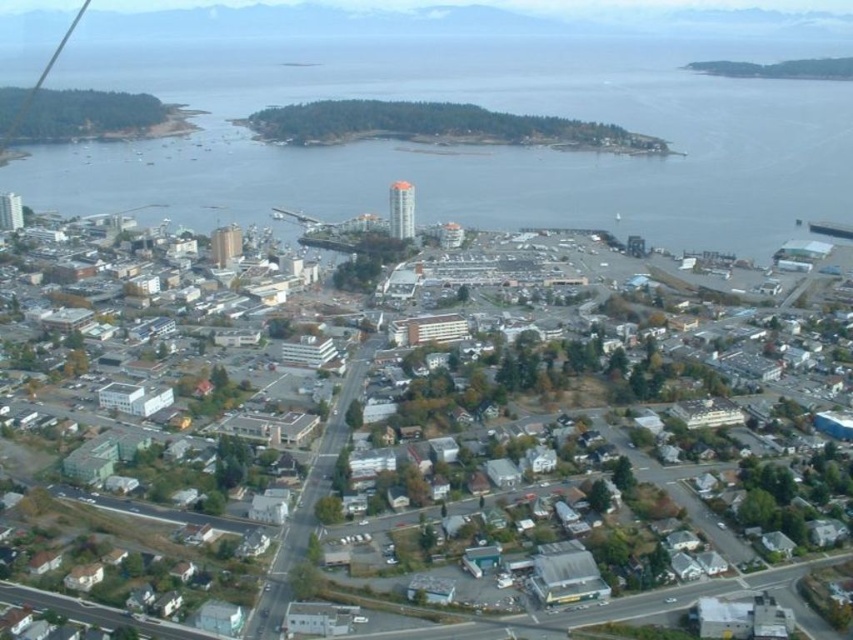
You are a drone operator flying over the coastal urban area. You have two points marked on your map, point (x=663, y=168) and point (x=405, y=356). Which point is closer to your current position?

Point (x=663, y=168) is closer to your current position because it is further to the viewer than point (x=405, y=356).

You are a drone operator flying over the coastal urban area. Your drone has a height limit of 10 meters. You need to capture a photo of both the clear water at center and the matte gray building at center. Can your drone fly high enough to include both in the frame without exceeding its height limit?

The clear water at center is taller than the matte gray building at center. Since the drone has a 10 meter height limit, it can fly up to that height. However, the question is whether the height required to frame both objects is within the limit. The description states the water is taller than the building, but without specific heights, we can infer that if the drone reaches a height where both are visible, it must stay under 10 meters. Assuming the tallest object here is the water, the drone needs to be at

In the scene shown: You are a city planner analyzing the aerial view of the coastal area. You need to determine if the clear water at center can accommodate a new boat dock that requires a minimum width of 20 meters. The matte gray building at center is currently 15 meters wide. Can the water area meet the width requirement?

The clear water at center has a larger width than the matte gray building at center, which is 15 meters wide. Therefore, the clear water at center is wider than 15 meters. Since the required minimum width for the boat dock is 20 meters, the water area may or may not meet the requirement depending on its exact width. However, based on the information provided, we can only confirm it is wider than 15 meters.